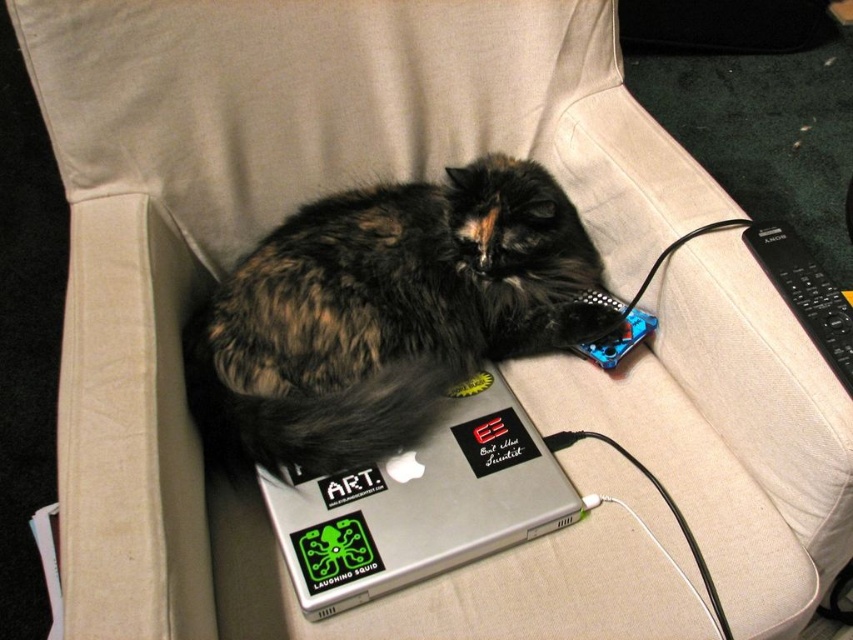
Based on the photo, you are a visitor in this room and want to place a small plant between the silver metallic laptop at center and the black plastic remote at right. Based on their positions, which object should the plant be closer to?

The silver metallic laptop at center is positioned on the left side of the black plastic remote at right, so the plant should be placed closer to the silver metallic laptop at center to be between them.

You are organizing a small shelf and need to stack the silver metallic laptop at center and the black plastic remote at right vertically. Which object should you place at the bottom to ensure stability?

The silver metallic laptop at center should be placed at the bottom because it is taller than the black plastic remote at right, providing a stable base for the stack.